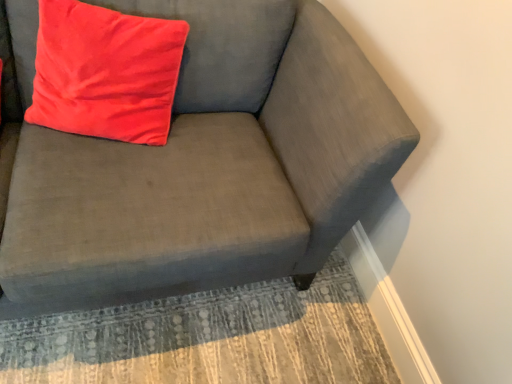
Question: From the image's perspective, does matte gray couch at upper right appear higher than matte red pillow at upper left?

Choices:
 (A) yes
 (B) no

Answer: (B)

Question: Can you confirm if matte gray couch at upper right is thinner than matte red pillow at upper left?

Choices:
 (A) no
 (B) yes

Answer: (A)

Question: From the image's perspective, does matte gray couch at upper right appear lower than matte red pillow at upper left?

Choices:
 (A) yes
 (B) no

Answer: (A)

Question: Does matte gray couch at upper right have a smaller size compared to matte red pillow at upper left?

Choices:
 (A) no
 (B) yes

Answer: (A)

Question: Are matte gray couch at upper right and matte red pillow at upper left far apart?

Choices:
 (A) yes
 (B) no

Answer: (B)

Question: Do you think matte gray couch at upper right is within textured beige rug at lower center, or outside of it?

Choices:
 (A) inside
 (B) outside

Answer: (B)

Question: From a real-world perspective, is matte gray couch at upper right physically located above or below textured beige rug at lower center?

Choices:
 (A) below
 (B) above

Answer: (B)

Question: Considering the positions of matte gray couch at upper right and textured beige rug at lower center in the image, is matte gray couch at upper right wider or thinner than textured beige rug at lower center?

Choices:
 (A) thin
 (B) wide

Answer: (A)

Question: From the image's perspective, relative to textured beige rug at lower center, is matte gray couch at upper right above or below?

Choices:
 (A) below
 (B) above

Answer: (B)

Question: Would you say matte red pillow at upper left is inside or outside matte gray couch at upper right?

Choices:
 (A) inside
 (B) outside

Answer: (A)

Question: Is matte red pillow at upper left in front of or behind matte gray couch at upper right in the image?

Choices:
 (A) behind
 (B) front

Answer: (A)

Question: Considering the relative positions of matte red pillow at upper left and matte gray couch at upper right in the image provided, is matte red pillow at upper left to the left or to the right of matte gray couch at upper right?

Choices:
 (A) right
 (B) left

Answer: (B)

Question: Is point (82, 112) closer or farther from the camera than point (374, 102)?

Choices:
 (A) farther
 (B) closer

Answer: (A)

Question: Considering the positions of point (92, 352) and point (115, 266), is point (92, 352) closer or farther from the camera than point (115, 266)?

Choices:
 (A) closer
 (B) farther

Answer: (B)

Question: Is textured beige rug at lower center taller or shorter than matte gray couch at upper right?

Choices:
 (A) tall
 (B) short

Answer: (B)